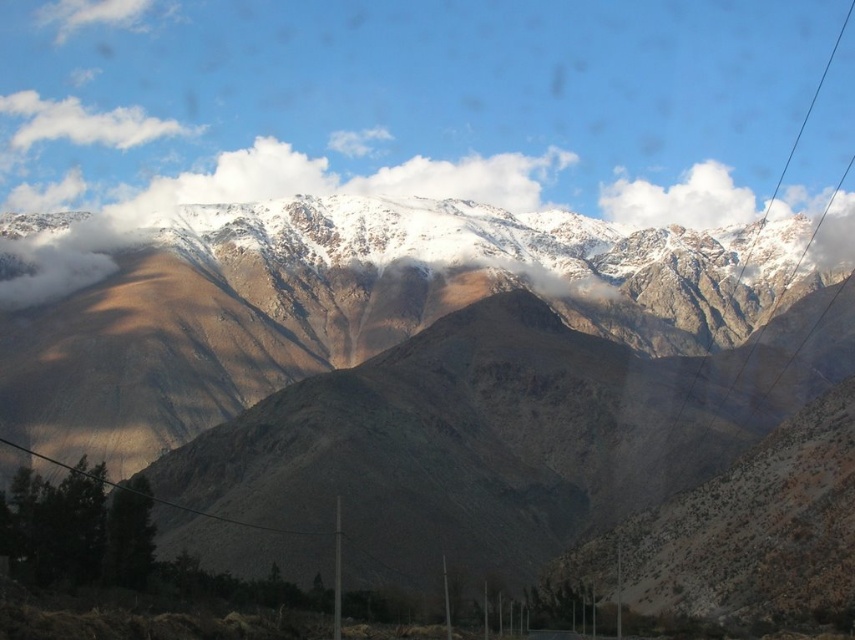
Does brown rocky mountain range at upper center appear over white fluffy cloud at upper left?

No.

Does brown rocky mountain range at upper center have a greater height compared to white fluffy cloud at upper left?

Yes.

Measure the distance between point (845, 330) and camera.

Point (845, 330) and camera are 1284.79 feet apart from each other.

Locate an element on the screen. The image size is (855, 640). brown rocky mountain range at upper center is located at coordinates (428, 364).

Does white fluffy cloud at upper center appear on the left side of white fluffy cloud at upper left?

In fact, white fluffy cloud at upper center is to the right of white fluffy cloud at upper left.

Measure the distance between point (634, 192) and camera.

Point (634, 192) and camera are 583.95 meters apart from each other.

Which is in front, point (614, 204) or point (152, 122)?

Point (614, 204)

At what (x,y) coordinates should I click in order to perform the action: click on white fluffy cloud at upper center. Please return your answer as a coordinate pair (x, y). Looking at the image, I should click on (679, 198).

Does brown rocky mountain range at upper center have a larger size compared to white fluffy cloud at upper center?

Yes.

Where is `brown rocky mountain range at upper center`? Image resolution: width=855 pixels, height=640 pixels. brown rocky mountain range at upper center is located at coordinates (428, 364).